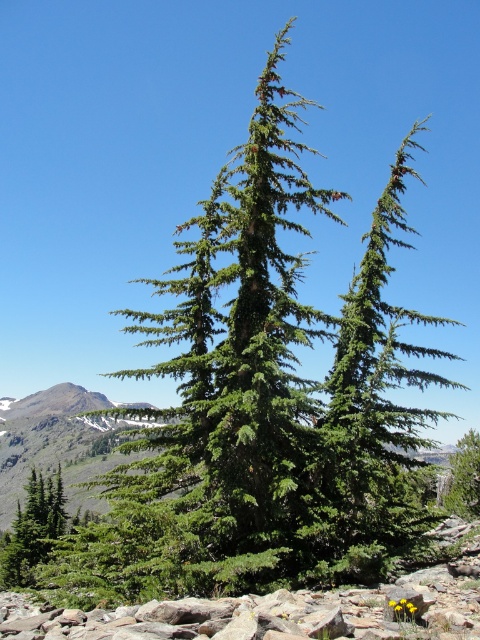
Question: Which of the following is the closest to the observer?

Choices:
 (A) green matte evergreen tree at lower left
 (B) green coniferous tree at center
 (C) green needle-like at center

Answer: (C)

Question: Can you confirm if green coniferous tree at center is smaller than green matte evergreen tree at lower left?

Choices:
 (A) yes
 (B) no

Answer: (B)

Question: Based on their relative distances, which object is farther from the green needle-like at center?

Choices:
 (A) green coniferous tree at center
 (B) green matte evergreen tree at lower left

Answer: (A)

Question: Does green coniferous tree at center have a larger size compared to green needle-like at center?

Choices:
 (A) yes
 (B) no

Answer: (A)

Question: Based on their relative distances, which object is farther from the green needle-like at center?

Choices:
 (A) green matte evergreen tree at lower left
 (B) green coniferous tree at center

Answer: (B)

Question: Can you confirm if green coniferous tree at center is wider than green matte evergreen tree at lower left?

Choices:
 (A) no
 (B) yes

Answer: (B)